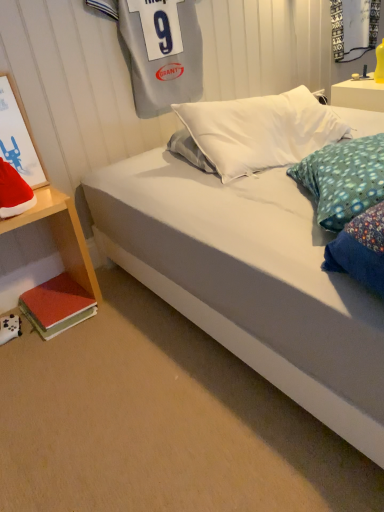
The height and width of the screenshot is (512, 384). I want to click on wooden nightstand at lower left, the second nightstand from the back, so click(64, 267).

This screenshot has width=384, height=512. What do you see at coordinates (250, 281) in the screenshot? I see `white fabric bed at lower left` at bounding box center [250, 281].

This screenshot has height=512, width=384. What do you see at coordinates (354, 27) in the screenshot? I see `transparent glass shop window at upper right` at bounding box center [354, 27].

Image resolution: width=384 pixels, height=512 pixels. What do you see at coordinates (57, 305) in the screenshot?
I see `red matte book at lower left` at bounding box center [57, 305].

Locate an element on the screen. This screenshot has width=384, height=512. matte white picture frame at left is located at coordinates (18, 136).

Looking at this image, can you tell me how much matte white picture frame at left and red velvet santa hat at left differ in facing direction?

0.3 degrees.

In the scene shown: Is matte white picture frame at left far from red velvet santa hat at left?

Actually, matte white picture frame at left and red velvet santa hat at left are a little close together.

Is the position of matte white picture frame at left less distant than that of red velvet santa hat at left?

No.

Is matte white picture frame at left bigger or smaller than red velvet santa hat at left?

Considering their sizes, matte white picture frame at left takes up more space than red velvet santa hat at left.

Based on their positions, is white glossy nightstand at upper right, positioned as the 1th nightstand in right-to-left order, located to the left or right of red matte book at lower left?

Clearly, white glossy nightstand at upper right, positioned as the 1th nightstand in right-to-left order, is on the right of red matte book at lower left in the image.

How different are the orientations of white glossy nightstand at upper right, marked as the 2th nightstand in a front-to-back arrangement, and red matte book at lower left in degrees?

The angle between the facing direction of white glossy nightstand at upper right, marked as the 2th nightstand in a front-to-back arrangement, and the facing direction of red matte book at lower left is 0.00797 degrees.

Who is bigger, white glossy nightstand at upper right, which is counted as the second nightstand, starting from the left, or red matte book at lower left?

Bigger between the two is white glossy nightstand at upper right, which is counted as the second nightstand, starting from the left.

From the image's perspective, is white glossy nightstand at upper right, positioned as the 1th nightstand in right-to-left order, over red matte book at lower left?

Yes, from the image's perspective, white glossy nightstand at upper right, positioned as the 1th nightstand in right-to-left order, is above red matte book at lower left.

Does matte white picture frame at left come behind white fabric bed at lower left?

Yes, matte white picture frame at left is behind white fabric bed at lower left.

The image size is (384, 512). In order to click on bed that is below the matte white picture frame at left (from the image's perspective) in this screenshot , I will do `click(250, 281)`.

Considering the relative sizes of matte white picture frame at left and white fabric bed at lower left in the image provided, is matte white picture frame at left thinner than white fabric bed at lower left?

Correct, the width of matte white picture frame at left is less than that of white fabric bed at lower left.

Is matte white picture frame at left positioned with its back to white fabric bed at lower left?

That's not correct — matte white picture frame at left is not looking away from white fabric bed at lower left.

How different are the orientations of red velvet santa hat at left and red matte book at lower left in degrees?

A: The angle between the facing direction of red velvet santa hat at left and the facing direction of red matte book at lower left is 3.14 degrees.

From a real-world perspective, is red velvet santa hat at left physically above red matte book at lower left?

Yes, from a real-world perspective, red velvet santa hat at left is over red matte book at lower left

Are red velvet santa hat at left and red matte book at lower left making contact?

No, red velvet santa hat at left is not touching red matte book at lower left.

In order to click on pillow in front of the red matte book at lower left in this screenshot , I will do `click(14, 192)`.

Visually, is red velvet santa hat at left positioned to the left or to the right of wooden nightstand at lower left, which is the 1th nightstand from front to back?

red velvet santa hat at left is to the left of wooden nightstand at lower left, which is the 1th nightstand from front to back.

In terms of height, does red velvet santa hat at left look taller or shorter compared to wooden nightstand at lower left, arranged as the 1th nightstand when ordered from the bottom?

In the image, red velvet santa hat at left appears to be shorter than wooden nightstand at lower left, arranged as the 1th nightstand when ordered from the bottom.

Is the depth of red velvet santa hat at left greater than that of wooden nightstand at lower left, which is counted as the second nightstand, starting from the top?

Yes, red velvet santa hat at left is further from the viewer.

Can you confirm if red velvet santa hat at left is bigger than wooden nightstand at lower left, which is counted as the second nightstand, starting from the top?

No, red velvet santa hat at left is not bigger than wooden nightstand at lower left, which is counted as the second nightstand, starting from the top.

Considering the sizes of objects white glossy nightstand at upper right, the first nightstand viewed from the top, and matte white picture frame at left in the image provided, who is thinner, white glossy nightstand at upper right, the first nightstand viewed from the top, or matte white picture frame at left?

matte white picture frame at left.

From the image's perspective, between white glossy nightstand at upper right, which is counted as the second nightstand, starting from the left, and matte white picture frame at left, which one is located above?

white glossy nightstand at upper right, which is counted as the second nightstand, starting from the left, is shown above in the image.

From a real-world perspective, who is located higher, white glossy nightstand at upper right, marked as the 2th nightstand in a front-to-back arrangement, or matte white picture frame at left?

matte white picture frame at left is physically above.

Does white glossy nightstand at upper right, positioned as the 1th nightstand in right-to-left order, turn towards matte white picture frame at left?

No, white glossy nightstand at upper right, positioned as the 1th nightstand in right-to-left order, does not turn towards matte white picture frame at left.

Which point is more forward, (349, 383) or (5, 187)?

The point (349, 383) is closer.

Is white fabric bed at lower left not inside red velvet santa hat at left?

white fabric bed at lower left is positioned outside red velvet santa hat at left.

From a real-world perspective, is white fabric bed at lower left positioned over red velvet santa hat at left based on gravity?

No, from a real-world perspective, white fabric bed at lower left is not above red velvet santa hat at left.

The height and width of the screenshot is (512, 384). Find the location of `pillow on the right of matte white picture frame at left`. pillow on the right of matte white picture frame at left is located at coordinates (14, 192).

Find the location of a particular element. The height and width of the screenshot is (512, 384). nightstand that appears behind the red matte book at lower left is located at coordinates (359, 94).

Which object lies further to the anchor point matte white picture frame at left, white fabric bed at lower left or wooden nightstand at lower left, the second nightstand from the back?

white fabric bed at lower left is positioned further to the anchor matte white picture frame at left.

From the image, which object appears to be nearer to matte white picture frame at left, red velvet santa hat at left or transparent glass shop window at upper right?

Among the two, red velvet santa hat at left is located nearer to matte white picture frame at left.

Estimate the real-world distances between objects in this image. Which object is further from red velvet santa hat at left, matte white picture frame at left or wooden nightstand at lower left, which is counted as the second nightstand, starting from the top?

wooden nightstand at lower left, which is counted as the second nightstand, starting from the top, lies further to red velvet santa hat at left than the other object.

Consider the image. Estimate the real-world distances between objects in this image. Which object is further from transparent glass shop window at upper right, red matte book at lower left or white glossy nightstand at upper right, positioned as the 1th nightstand in right-to-left order?

red matte book at lower left.

Based on their spatial positions, is red velvet santa hat at left or white glossy nightstand at upper right, which is counted as the 2th nightstand, starting from the bottom, closer to transparent glass shop window at upper right?

white glossy nightstand at upper right, which is counted as the 2th nightstand, starting from the bottom, is closer to transparent glass shop window at upper right.

Considering their positions, is transparent glass shop window at upper right positioned further to red velvet santa hat at left than red matte book at lower left?

transparent glass shop window at upper right is further to red velvet santa hat at left.

Looking at the image, which one is located closer to white glossy nightstand at upper right, positioned as the 1th nightstand in right-to-left order, white fabric bed at lower left or transparent glass shop window at upper right?

The object closer to white glossy nightstand at upper right, positioned as the 1th nightstand in right-to-left order, is transparent glass shop window at upper right.

Which object lies further to the anchor point red velvet santa hat at left, matte white picture frame at left or red matte book at lower left?

Based on the image, red matte book at lower left appears to be further to red velvet santa hat at left.

Locate an element on the screen. This screenshot has height=512, width=384. book located between wooden nightstand at lower left, the second nightstand from the back, and transparent glass shop window at upper right in the left-right direction is located at coordinates (57, 305).

The image size is (384, 512). I want to click on picture frame located between white fabric bed at lower left and red matte book at lower left in the depth direction, so click(x=18, y=136).

Where is `nightstand between red velvet santa hat at left and white fabric bed at lower left`? The width and height of the screenshot is (384, 512). nightstand between red velvet santa hat at left and white fabric bed at lower left is located at coordinates (64, 267).

Image resolution: width=384 pixels, height=512 pixels. In order to click on pillow between white fabric bed at lower left and red matte book at lower left along the z-axis in this screenshot , I will do `click(14, 192)`.